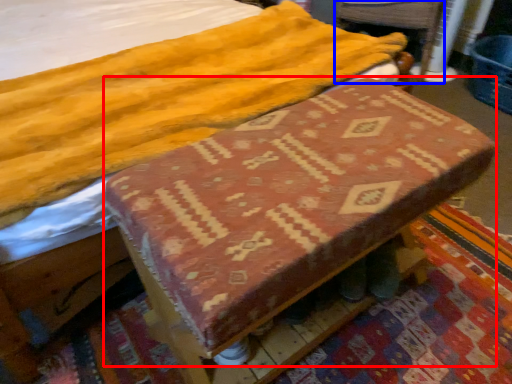
Question: Among these objects, which one is farthest to the camera, changing table (highlighted by a red box) or swivel chair (highlighted by a blue box)?

Choices:
 (A) changing table
 (B) swivel chair

Answer: (B)